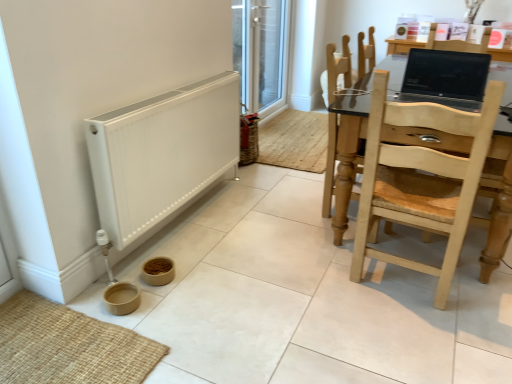
The width and height of the screenshot is (512, 384). I want to click on vacant space underneath light wood chair at right, the first chair in the front-to-back sequence (from a real-world perspective), so click(406, 285).